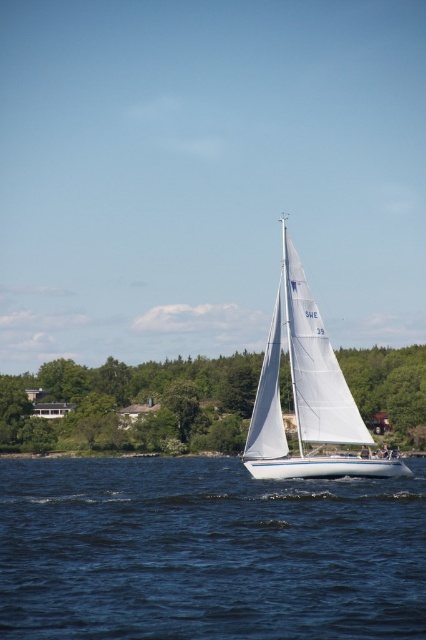
You are standing on the deck of the white sailboat at center and want to look at the green leafy tree at center. Which object is closer to you when you look forward?

The green leafy tree at center is closer to you than the white sailboat at center because it is positioned further to the viewer.

In the scene shown: You are standing on the deck of the sailboat and see the point marked at coordinates (207, 552). Based on the scene description, what is the location of this point relative to the sailboat?

The point at coordinates (207, 552) corresponds to the blue water at center, so it is located at the center of the water area relative to the sailboat.